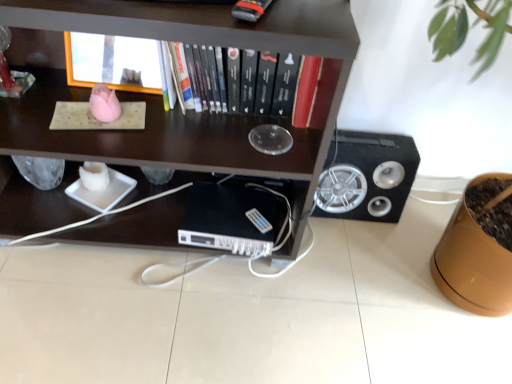
Find the location of a particular element. vacant point to the right of dark wood shelf at upper center, arranged as the 1th shelf when ordered from the bottom is located at coordinates (354, 293).